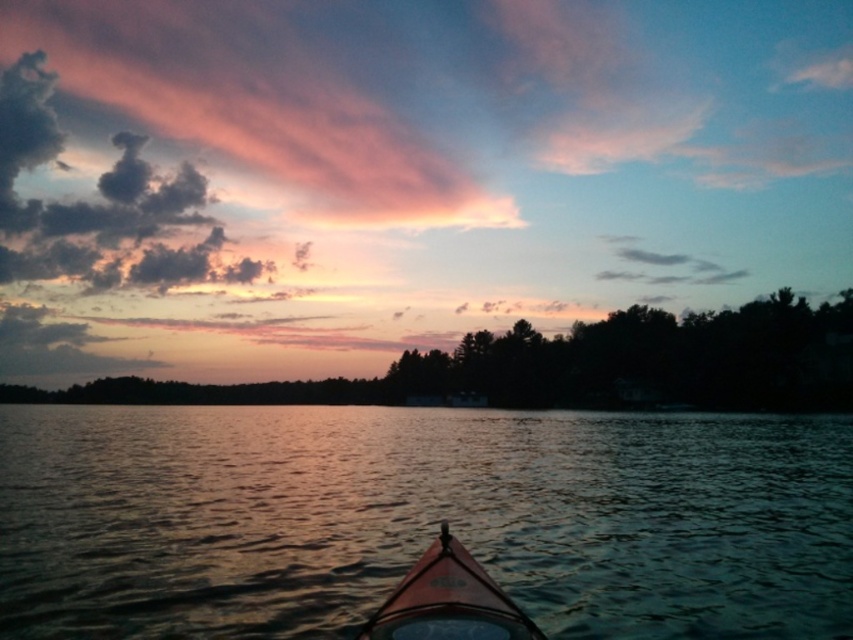
Question: Is shiny dark water at center further to camera compared to orange matte kayak at center?

Choices:
 (A) yes
 (B) no

Answer: (A)

Question: Does shiny dark water at center appear on the right side of orange matte kayak at center?

Choices:
 (A) yes
 (B) no

Answer: (A)

Question: Among these points, which one is farthest from the camera?

Choices:
 (A) (482, 604)
 (B) (161, 477)

Answer: (B)

Question: Can you confirm if shiny dark water at center is positioned to the left of orange matte kayak at center?

Choices:
 (A) yes
 (B) no

Answer: (B)